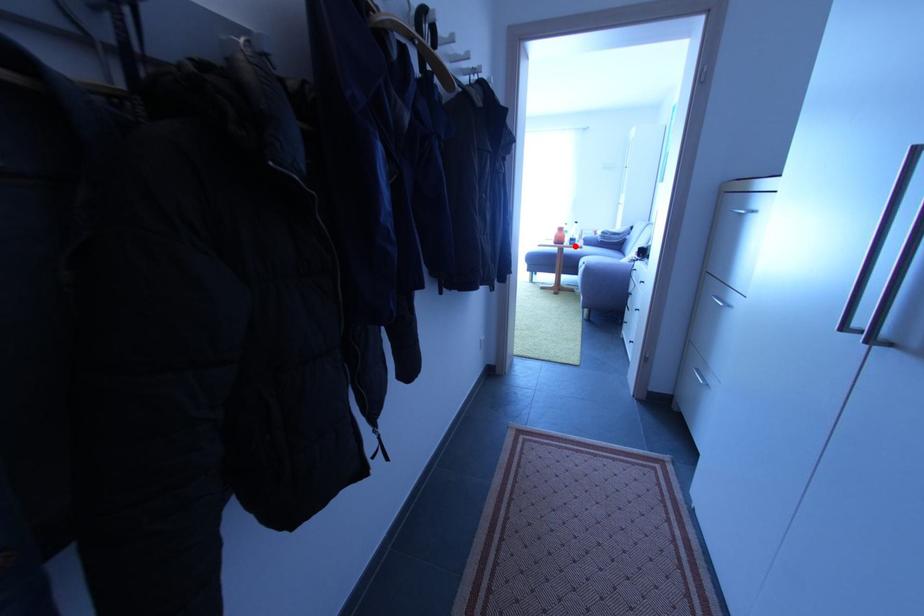
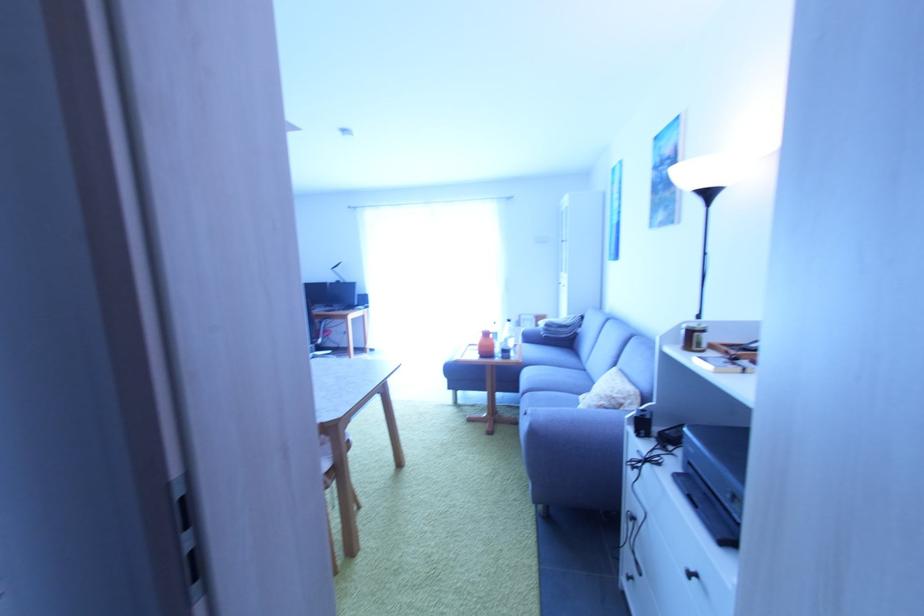
Locate, in the second image, the point that corresponds to the highlighted location in the first image.

(507, 360)